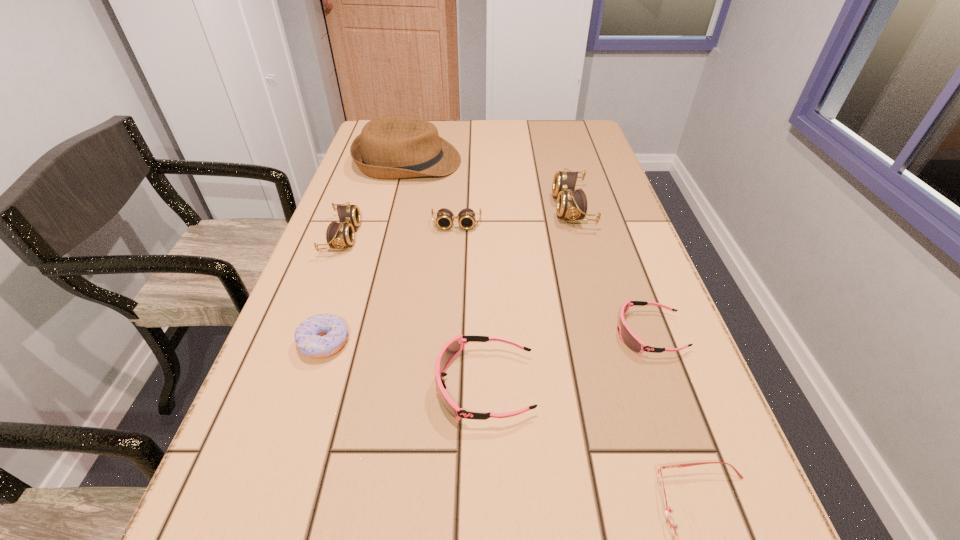
Where is `the smaller pink goggles`? This screenshot has height=540, width=960. the smaller pink goggles is located at coordinates (628, 337).

Where is `vacant space located on the front-facing side of the brown fedora`? The height and width of the screenshot is (540, 960). vacant space located on the front-facing side of the brown fedora is located at coordinates (580, 161).

Where is `free region located 0.330m through the lenses of the tallest goggles`? This screenshot has height=540, width=960. free region located 0.330m through the lenses of the tallest goggles is located at coordinates (428, 208).

Locate an element on the screen. free region located 0.140m through the lenses of the tallest goggles is located at coordinates (500, 208).

Identify the location of free region located through the lenses of the tallest goggles. (519, 208).

Locate an element on the screen. blank space located through the lenses of the leftmost goggles is located at coordinates (437, 237).

I want to click on free region located on the front-facing side of the bigger pink goggles, so click(275, 385).

I want to click on free spot located 0.150m on the front-facing side of the bigger pink goggles, so click(349, 385).

The width and height of the screenshot is (960, 540). I want to click on vacant space situated on the front-facing side of the bigger pink goggles, so click(x=384, y=385).

Locate an element on the screen. This screenshot has height=540, width=960. free space located 0.220m through the lenses of the smallest brown goggles is located at coordinates (451, 296).